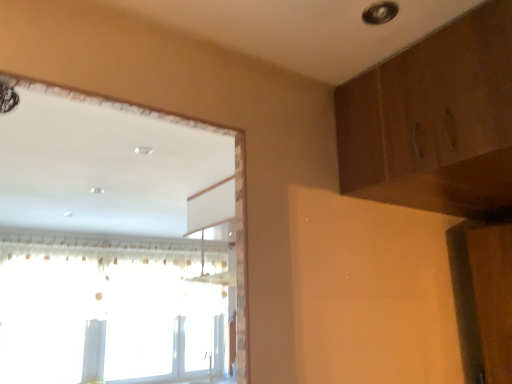
Question: From a real-world perspective, is white sheer curtain at left beneath transparent plastic window at upper left?

Choices:
 (A) yes
 (B) no

Answer: (B)

Question: Are white sheer curtain at left and transparent plastic window at upper left located far from each other?

Choices:
 (A) no
 (B) yes

Answer: (A)

Question: Is transparent plastic window at upper left inside white sheer curtain at left?

Choices:
 (A) no
 (B) yes

Answer: (B)

Question: Is white sheer curtain at left facing away from transparent plastic window at upper left?

Choices:
 (A) no
 (B) yes

Answer: (B)

Question: Considering the relative positions of white sheer curtain at left and transparent plastic window at upper left in the image provided, is white sheer curtain at left in front of transparent plastic window at upper left?

Choices:
 (A) no
 (B) yes

Answer: (B)

Question: Is white sheer curtain at left at the left side of transparent plastic window at upper left?

Choices:
 (A) no
 (B) yes

Answer: (A)

Question: Is transparent plastic window at upper left with white sheer curtain at left?

Choices:
 (A) no
 (B) yes

Answer: (A)

Question: Can you confirm if transparent plastic window at upper left is thinner than white sheer curtain at left?

Choices:
 (A) no
 (B) yes

Answer: (B)

Question: Considering the relative sizes of transparent plastic window at upper left and white sheer curtain at left in the image provided, is transparent plastic window at upper left bigger than white sheer curtain at left?

Choices:
 (A) yes
 (B) no

Answer: (B)

Question: Can you confirm if transparent plastic window at upper left is shorter than white sheer curtain at left?

Choices:
 (A) yes
 (B) no

Answer: (B)

Question: Is white sheer curtain at left located within transparent plastic window at upper left?

Choices:
 (A) yes
 (B) no

Answer: (B)

Question: Considering the relative positions of transparent plastic window at upper left and white sheer curtain at left in the image provided, is transparent plastic window at upper left to the left of white sheer curtain at left from the viewer's perspective?

Choices:
 (A) yes
 (B) no

Answer: (A)

Question: Is wooden dresser at upper right thinner than white sheer curtain at left?

Choices:
 (A) yes
 (B) no

Answer: (B)